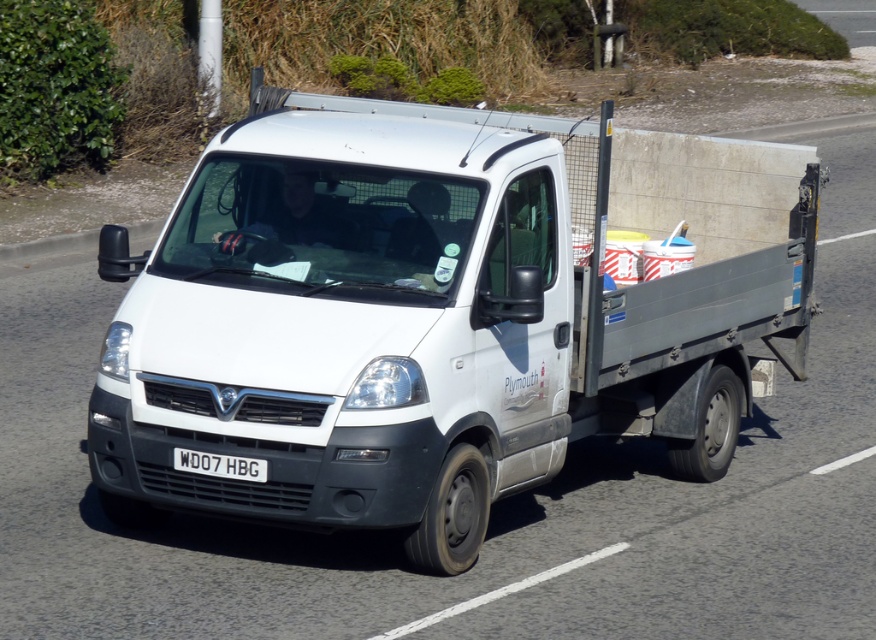
Consider the image. You are a delivery driver who needs to ensure the license plate is visible for security cameras. Are you able to see the white plastic license plate at center from the driver seat while driving the white matte van at center?

The white matte van at center is positioned over white plastic license plate at center, so the license plate might be obstructed and not fully visible from the driver seat.

You are a photographer trying to capture the van from the front. You notice two points on the van, one at point (450, 323) and another at point (175, 468). Which point will appear larger in your photo?

Point (450, 323) is closer to the camera than point (175, 468), so it will appear larger in the photo.